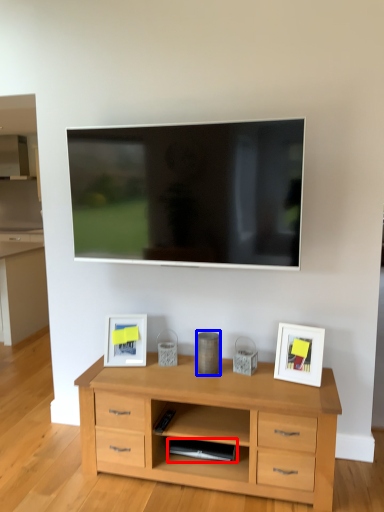
Question: Which object is closer to the camera taking this photo, appliance (highlighted by a red box) or appliance (highlighted by a blue box)?

Choices:
 (A) appliance
 (B) appliance

Answer: (A)